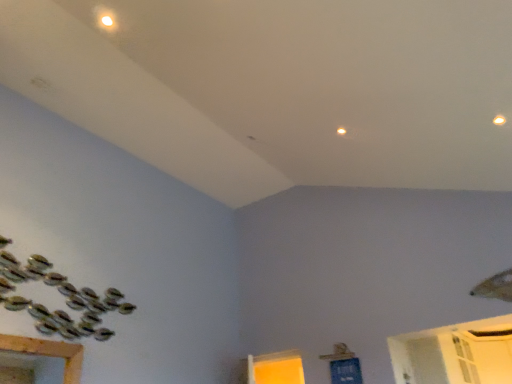
This screenshot has width=512, height=384. What do you see at coordinates (499, 120) in the screenshot? I see `matte yellow light at upper right` at bounding box center [499, 120].

Where is `matte yellow light at upper right`? Image resolution: width=512 pixels, height=384 pixels. matte yellow light at upper right is located at coordinates (499, 120).

Locate an element on the screen. matte yellow light at upper right is located at coordinates (499, 120).